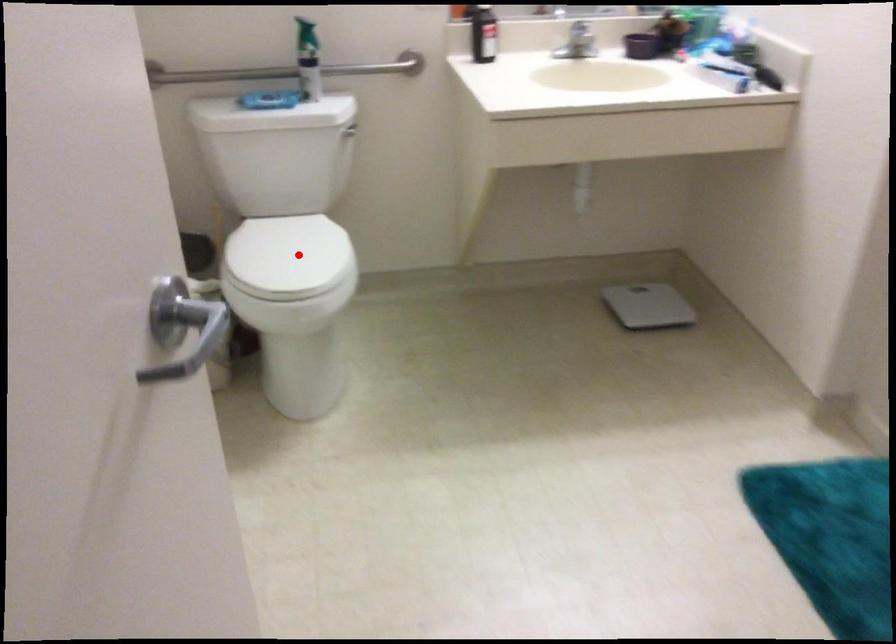
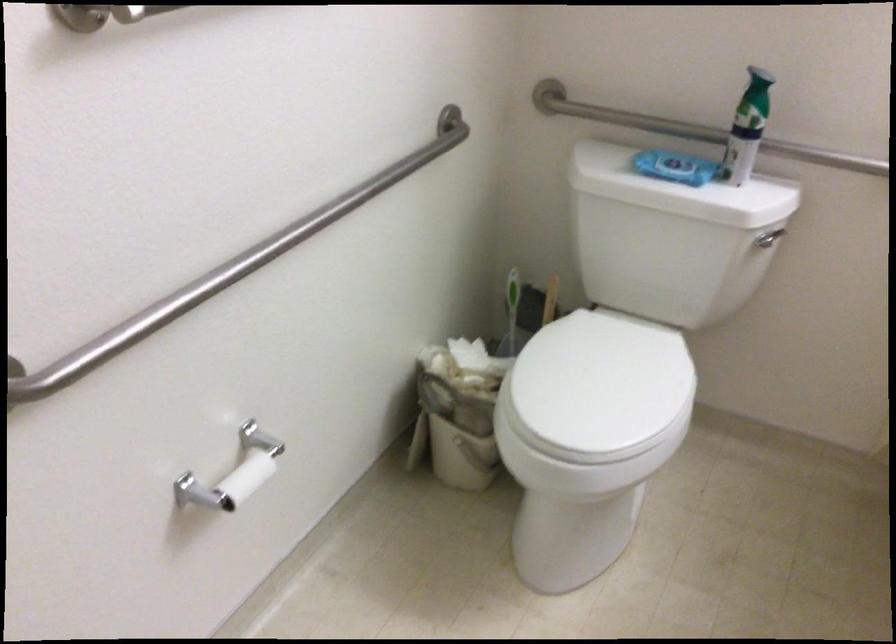
Question: I am providing you with two images of the same scene from different viewpoints. A red point is shown in image1. For the corresponding object point in image2, is it positioned nearer or farther from the camera?

Choices:
 (A) Nearer
 (B) Farther

Answer: (A)